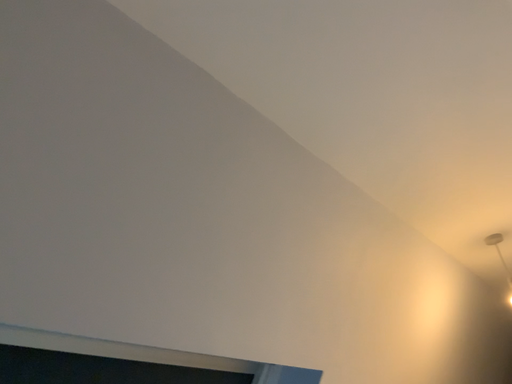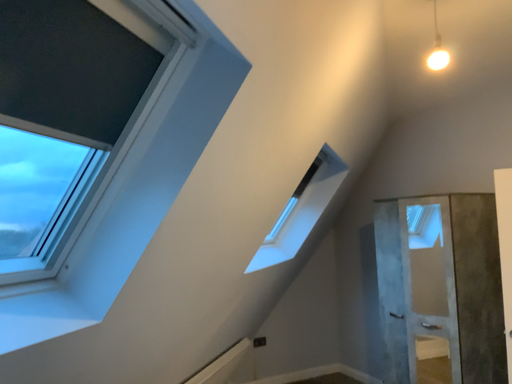
Question: Which way did the camera rotate in the video?

Choices:
 (A) rotated right
 (B) rotated left

Answer: (A)